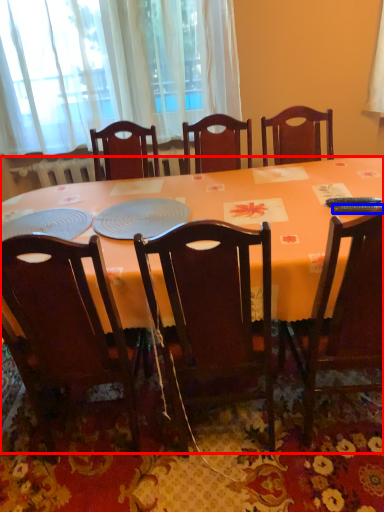
Question: Among these objects, which one is nearest to the camera, desk (highlighted by a red box) or remote control (highlighted by a blue box)?

Choices:
 (A) desk
 (B) remote control

Answer: (A)